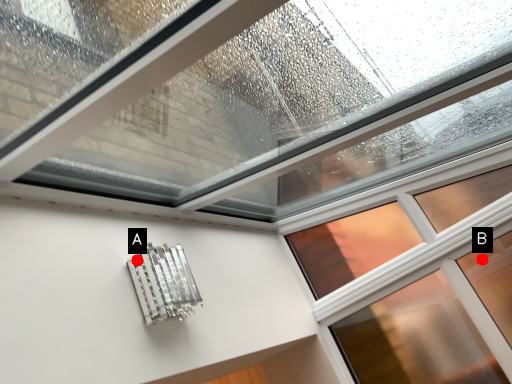
Question: Two points are circled on the image, labeled by A and B beside each circle. Which point is farther to the camera?

Choices:
 (A) A is further
 (B) B is further

Answer: (B)